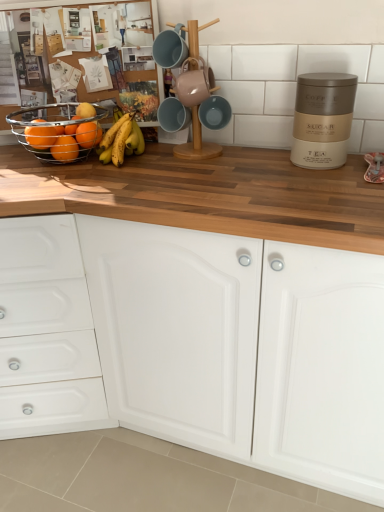
Question: Considering the relative sizes of yellow matte bananas at center and matte orange at left, marked as the third orange in a back-to-front arrangement, in the image provided, is yellow matte bananas at center shorter than matte orange at left, marked as the third orange in a back-to-front arrangement,?

Choices:
 (A) no
 (B) yes

Answer: (A)

Question: Considering the relative positions of yellow matte bananas at center and matte orange at left, marked as the third orange in a back-to-front arrangement, in the image provided, is yellow matte bananas at center to the right of matte orange at left, marked as the third orange in a back-to-front arrangement, from the viewer's perspective?

Choices:
 (A) no
 (B) yes

Answer: (B)

Question: Is yellow matte bananas at center touching matte orange at left, marked as the third orange in a back-to-front arrangement?

Choices:
 (A) yes
 (B) no

Answer: (B)

Question: Is yellow matte bananas at center located outside matte orange at left, marked as the third orange in a back-to-front arrangement?

Choices:
 (A) yes
 (B) no

Answer: (A)

Question: Is yellow matte bananas at center smaller than matte orange at left, marked as the third orange in a back-to-front arrangement?

Choices:
 (A) no
 (B) yes

Answer: (A)

Question: Considering their positions, is orange matte at left, the first orange in the back-to-front sequence, located in front of or behind matte orange fruit at left, positioned as the third orange in front-to-back order?

Choices:
 (A) behind
 (B) front

Answer: (A)

Question: Is orange matte at left, the first orange in the back-to-front sequence, inside or outside of matte orange fruit at left, the second orange when ordered from back to front?

Choices:
 (A) inside
 (B) outside

Answer: (B)

Question: Looking at their shapes, would you say orange matte at left, the first orange in the back-to-front sequence, is wider or thinner than matte orange fruit at left, positioned as the third orange in front-to-back order?

Choices:
 (A) thin
 (B) wide

Answer: (A)

Question: From the image's perspective, is orange matte at left, positioned as the fourth orange in front-to-back order, located above or below matte orange fruit at left, the second orange when ordered from back to front?

Choices:
 (A) above
 (B) below

Answer: (A)

Question: Based on their sizes in the image, would you say matte orange fruit at left, positioned as the third orange in front-to-back order, is bigger or smaller than yellow matte bananas at center?

Choices:
 (A) small
 (B) big

Answer: (A)

Question: Would you say matte orange fruit at left, positioned as the third orange in front-to-back order, is to the left or to the right of yellow matte bananas at center in the picture?

Choices:
 (A) left
 (B) right

Answer: (A)

Question: Is matte orange fruit at left, positioned as the third orange in front-to-back order, inside or outside of yellow matte bananas at center?

Choices:
 (A) outside
 (B) inside

Answer: (A)

Question: From a real-world perspective, relative to yellow matte bananas at center, is matte orange fruit at left, positioned as the third orange in front-to-back order, vertically above or below?

Choices:
 (A) below
 (B) above

Answer: (A)

Question: In the image, is yellow matte bananas at center on the left side or the right side of orange matte at left, the first orange in the back-to-front sequence?

Choices:
 (A) right
 (B) left

Answer: (A)

Question: In terms of height, does yellow matte bananas at center look taller or shorter compared to orange matte at left, the first orange in the back-to-front sequence?

Choices:
 (A) tall
 (B) short

Answer: (A)